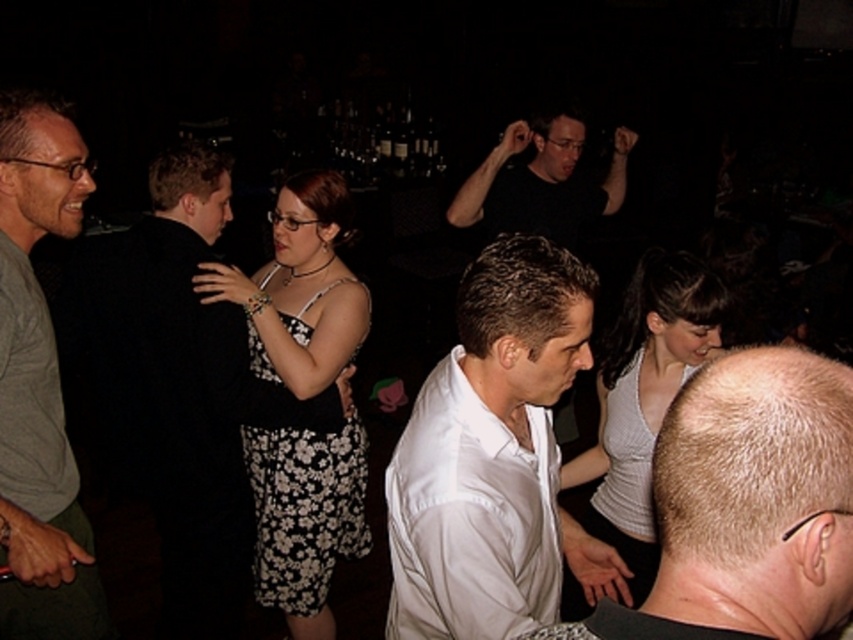
Question: Which point appears closest to the camera in this image?

Choices:
 (A) (543, 164)
 (B) (695, 285)
 (C) (627, 589)
 (D) (344, 470)

Answer: (C)

Question: Is gray cotton shirt at left to the left of black floral dress at center from the viewer's perspective?

Choices:
 (A) no
 (B) yes

Answer: (B)

Question: Does white smooth shirt at center lie in front of black matte shirt at upper center?

Choices:
 (A) no
 (B) yes

Answer: (B)

Question: Which of these objects is positioned closest to the gray cotton shirt at left?

Choices:
 (A) black fabric shirt at left
 (B) white cotton shirt at center

Answer: (A)

Question: Which of the following is the closest to the observer?

Choices:
 (A) white smooth shirt at center
 (B) black floral dress at center
 (C) black matte shirt at upper center
 (D) white cotton shirt at center

Answer: (A)

Question: Does black fabric shirt at left appear on the left side of white cotton shirt at center?

Choices:
 (A) yes
 (B) no

Answer: (A)